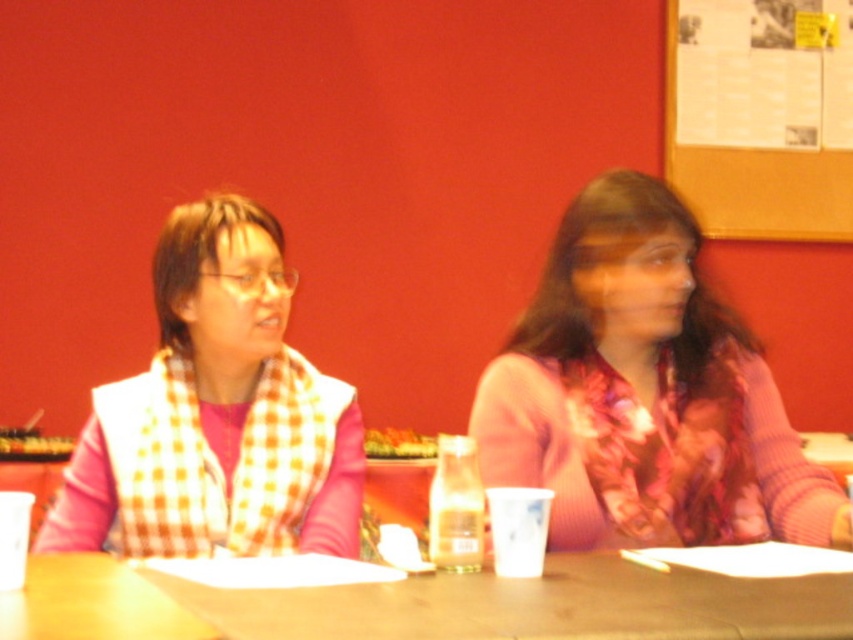
Question: Which point is closer to the camera?

Choices:
 (A) (836, 241)
 (B) (306, 432)

Answer: (B)

Question: Which of the following is the farthest from the observer?

Choices:
 (A) corkboard at upper right
 (B) wooden table at center
 (C) checkered scarf at left
 (D) floral scarf at center

Answer: (A)

Question: Is checkered scarf at left to the right of wooden table at center from the viewer's perspective?

Choices:
 (A) no
 (B) yes

Answer: (A)

Question: Considering the relative positions of floral scarf at center and wooden table at center in the image provided, where is floral scarf at center located with respect to wooden table at center?

Choices:
 (A) above
 (B) below

Answer: (A)

Question: Considering the real-world distances, which object is farthest from the checkered scarf at left?

Choices:
 (A) wooden table at center
 (B) corkboard at upper right

Answer: (B)

Question: Can you confirm if wooden table at center is bigger than corkboard at upper right?

Choices:
 (A) no
 (B) yes

Answer: (A)